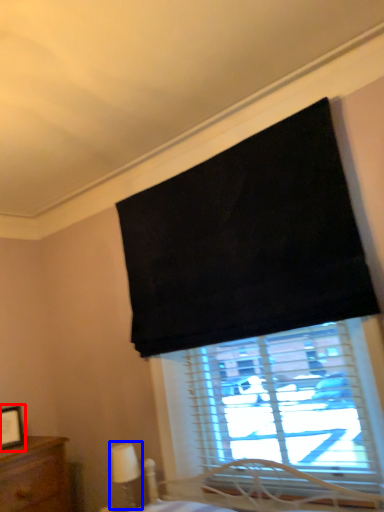
Question: Which point is closer to the camera, picture frame (highlighted by a red box) or table lamp (highlighted by a blue box)?

Choices:
 (A) picture frame
 (B) table lamp

Answer: (B)